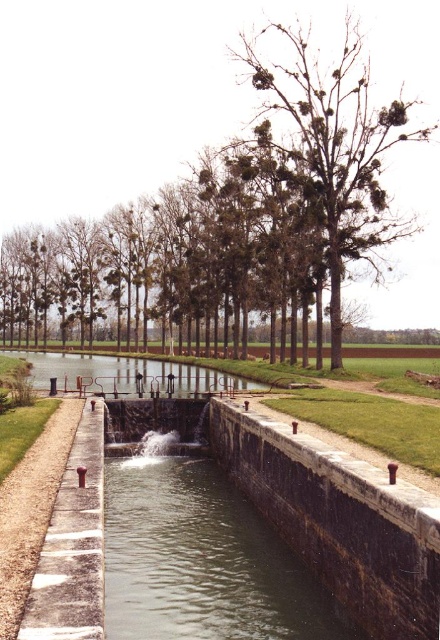
Who is more forward, (80, 632) or (205, 380)?

Positioned in front is point (80, 632).

Can you confirm if concrete sidewalk at lower left is positioned to the right of smooth concrete waterway at center?

Yes, concrete sidewalk at lower left is to the right of smooth concrete waterway at center.

Is point (84, 579) positioned behind point (208, 380)?

No, (84, 579) is in front of (208, 380).

You are a GUI agent. You are given a task and a screenshot of the screen. Output one action in this format:
    pyautogui.click(x=<x>, y=<y>)
    Task: Click on the concrete sidewalk at lower left
    Image resolution: width=440 pixels, height=640 pixels.
    Given the screenshot: What is the action you would take?
    pyautogui.click(x=73, y=545)

Between point (191, 115) and point (160, 388), which one is positioned in front?

Point (160, 388) is in front.

Can you confirm if brown leafless tree at center is taller than smooth concrete waterway at center?

Yes, brown leafless tree at center is taller than smooth concrete waterway at center.

Between point (25, 26) and point (150, 381), which one is positioned behind?

The point (25, 26) is more distant.

Find the location of a particular element. The width and height of the screenshot is (440, 640). brown leafless tree at center is located at coordinates (197, 109).

Who is shorter, brown leafless tree at center or concrete sidewalk at lower left?

With less height is concrete sidewalk at lower left.

Does brown leafless tree at center appear under concrete sidewalk at lower left?

Actually, brown leafless tree at center is above concrete sidewalk at lower left.

Between point (3, 152) and point (69, 609), which one is positioned behind?

Point (3, 152)

Where is `brown leafless tree at center`? brown leafless tree at center is located at coordinates (197, 109).